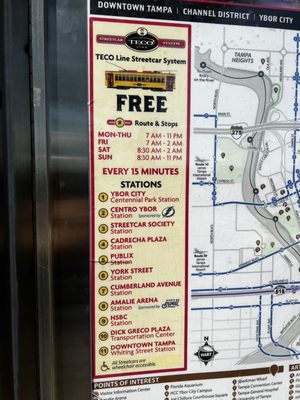
Locate an element on the screen. The width and height of the screenshot is (300, 400). wall is located at coordinates (67, 117).